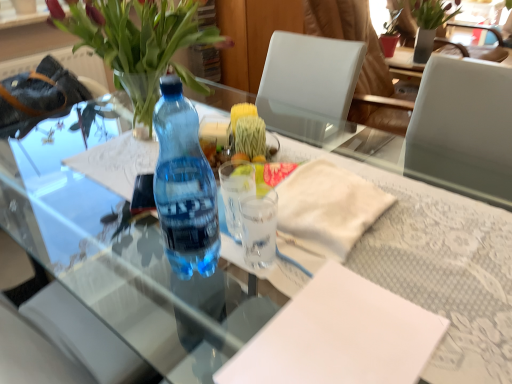
Describe the element at coordinates (139, 43) in the screenshot. The width and height of the screenshot is (512, 384). I see `translucent glass vase at upper left` at that location.

This screenshot has height=384, width=512. What are the coordinates of `transparent plastic bottle at center` in the screenshot? It's located at [x=184, y=186].

Find the location of a particular element. green matte vase at upper right is located at coordinates pyautogui.click(x=429, y=24).

Looking at this image, what is the approximate width of transparent glass cup at center, the 2th coffee cup positioned from the front?

The width of transparent glass cup at center, the 2th coffee cup positioned from the front, is 2.53 inches.

The width and height of the screenshot is (512, 384). Identify the location of translucent glass vase at upper left. (139, 43).

Is transparent glass cup at center, which is the second coffee cup from back to front, not close to transparent plastic bottle at center?

That's not correct — transparent glass cup at center, which is the second coffee cup from back to front, is a little close to transparent plastic bottle at center.

Between transparent glass cup at center, which is the second coffee cup from back to front, and transparent plastic bottle at center, which one has smaller size?

transparent glass cup at center, which is the second coffee cup from back to front, is smaller.

Does transparent glass cup at center, which is the second coffee cup from back to front, have a greater width compared to transparent plastic bottle at center?

In fact, transparent glass cup at center, which is the second coffee cup from back to front, might be narrower than transparent plastic bottle at center.

Which object is further away from the camera taking this photo, transparent glass cup at center, which is the second coffee cup from back to front, or transparent plastic bottle at center?

transparent glass cup at center, which is the second coffee cup from back to front, is more distant.

From their relative heights in the image, would you say white paper at center, the first notepad when ordered from top to bottom, is taller or shorter than transparent plastic bottle at center?

In the image, white paper at center, the first notepad when ordered from top to bottom, appears to be shorter than transparent plastic bottle at center.

Is white paper at center, the second notepad in the front-to-back sequence, oriented towards transparent plastic bottle at center?

No, white paper at center, the second notepad in the front-to-back sequence, is not oriented towards transparent plastic bottle at center.

Between white paper at center, marked as the 1th notepad in a back-to-front arrangement, and transparent plastic bottle at center, which one has smaller width?

transparent plastic bottle at center is thinner.

Is white paper at center, the first notepad when ordered from top to bottom, situated inside transparent plastic bottle at center or outside?

white paper at center, the first notepad when ordered from top to bottom, is not inside transparent plastic bottle at center, it's outside.

Consider the image. Is transparent glass cup at center, the 2th coffee cup positioned from the front, located outside transparent plastic bottle at center?

Yes.

From the picture: How distant is transparent glass cup at center, the 2th coffee cup positioned from the front, from transparent plastic bottle at center?

They are 5.25 inches apart.

Is point (230, 175) more distant than point (155, 130)?

That is False.

From a real-world perspective, between transparent glass cup at center, the 2th coffee cup positioned from the front, and transparent plastic bottle at center, who is vertically higher?

transparent plastic bottle at center is physically above.

From the picture: Between white paper at center, the first notepad when ordered from bottom to top, and transparent glass cup at center, acting as the 1th coffee cup starting from the front, which one has less height?

white paper at center, the first notepad when ordered from bottom to top.

Which of these two, white paper at center, the 2th notepad when ordered from top to bottom, or transparent glass cup at center, which is the second coffee cup from back to front, is thinner?

transparent glass cup at center, which is the second coffee cup from back to front, is thinner.

Is transparent glass cup at center, which is the second coffee cup from back to front, located within white paper at center, positioned as the second notepad in back-to-front order?

No, transparent glass cup at center, which is the second coffee cup from back to front, is not inside white paper at center, positioned as the second notepad in back-to-front order.

Can you confirm if transparent glass cup at center, arranged as the first coffee cup when viewed from the back, is positioned to the right of white paper at center, marked as the 1th notepad in a back-to-front arrangement?

No.

Is transparent glass cup at center, arranged as the first coffee cup when viewed from the back, positioned with its back to white paper at center, which is counted as the 2th notepad, starting from the bottom?

No, transparent glass cup at center, arranged as the first coffee cup when viewed from the back,'s orientation is not away from white paper at center, which is counted as the 2th notepad, starting from the bottom.

Between transparent glass cup at center, arranged as the first coffee cup when viewed from the back, and white paper at center, which is counted as the 2th notepad, starting from the bottom, which one has smaller width?

Thinner between the two is transparent glass cup at center, arranged as the first coffee cup when viewed from the back.

Consider the image. Does transparent plastic bottle at center have a lesser width compared to translucent glass vase at upper left?

Yes, transparent plastic bottle at center is thinner than translucent glass vase at upper left.

From the image's perspective, is transparent plastic bottle at center over translucent glass vase at upper left?

Actually, transparent plastic bottle at center appears below translucent glass vase at upper left in the image.

From a real-world perspective, between transparent plastic bottle at center and translucent glass vase at upper left, who is vertically higher?

In real-world perspective, translucent glass vase at upper left is above.

How far apart are transparent plastic bottle at center and translucent glass vase at upper left?

transparent plastic bottle at center is 10.35 inches away from translucent glass vase at upper left.

Does point (296, 347) appear closer or farther from the camera than point (433, 18)?

Clearly, point (296, 347) is closer to the camera than point (433, 18).

Which object is closer to the camera taking this photo, white paper at center, the first notepad when ordered from bottom to top, or green matte vase at upper right?

white paper at center, the first notepad when ordered from bottom to top, is in front.

Which of these two, white paper at center, which is the 1th notepad from front to back, or green matte vase at upper right, stands shorter?

white paper at center, which is the 1th notepad from front to back.

This screenshot has height=384, width=512. Find the location of `bottle on the left of transparent glass cup at center, acting as the 1th coffee cup starting from the front`. bottle on the left of transparent glass cup at center, acting as the 1th coffee cup starting from the front is located at coordinates (184, 186).

Identify the location of bottle that appears above the white paper at center, the first notepad when ordered from top to bottom (from the image's perspective). (184, 186).

Considering their positions, is transparent glass cup at center, which is the second coffee cup from back to front, positioned closer to green matte vase at upper right than white paper at center, marked as the 1th notepad in a back-to-front arrangement?

white paper at center, marked as the 1th notepad in a back-to-front arrangement, is closer to green matte vase at upper right.

Estimate the real-world distances between objects in this image. Which object is further from white paper at center, the second notepad in the front-to-back sequence, white paper at center, the 2th notepad when ordered from top to bottom, or green matte vase at upper right?

Among the two, green matte vase at upper right is located further to white paper at center, the second notepad in the front-to-back sequence.

Based on the photo, considering their positions, is translucent glass vase at upper left positioned closer to white paper at center, which is counted as the 2th notepad, starting from the bottom, than transparent glass cup at center, the 2th coffee cup positioned from the front?

Based on the image, transparent glass cup at center, the 2th coffee cup positioned from the front, appears to be nearer to white paper at center, which is counted as the 2th notepad, starting from the bottom.

Estimate the real-world distances between objects in this image. Which object is closer to transparent plastic bottle at center, translucent glass vase at upper left or green matte vase at upper right?

translucent glass vase at upper left is positioned closer to the anchor transparent plastic bottle at center.

Estimate the real-world distances between objects in this image. Which object is closer to translucent glass vase at upper left, green matte vase at upper right or transparent glass cup at center, arranged as the first coffee cup when viewed from the back?

transparent glass cup at center, arranged as the first coffee cup when viewed from the back, is closer to translucent glass vase at upper left.

Looking at this image, from the image, which object appears to be farther from green matte vase at upper right, white paper at center, which is the 1th notepad from front to back, or white paper at center, which is counted as the 2th notepad, starting from the bottom?

white paper at center, which is the 1th notepad from front to back, lies further to green matte vase at upper right than the other object.

Estimate the real-world distances between objects in this image. Which object is further from translucent glass vase at upper left, white paper at center, the first notepad when ordered from top to bottom, or white paper at center, which is the 1th notepad from front to back?

white paper at center, which is the 1th notepad from front to back.

Which object lies nearer to the anchor point white paper at center, which is counted as the 2th notepad, starting from the bottom, transparent glass cup at center, acting as the 1th coffee cup starting from the front, or white paper at center, which is the 1th notepad from front to back?

transparent glass cup at center, acting as the 1th coffee cup starting from the front, lies closer to white paper at center, which is counted as the 2th notepad, starting from the bottom, than the other object.

The width and height of the screenshot is (512, 384). Find the location of `notepad located between white paper at center, which is the 1th notepad from front to back, and transparent glass cup at center, arranged as the first coffee cup when viewed from the back, in the depth direction`. notepad located between white paper at center, which is the 1th notepad from front to back, and transparent glass cup at center, arranged as the first coffee cup when viewed from the back, in the depth direction is located at coordinates (328, 207).

Image resolution: width=512 pixels, height=384 pixels. Find the location of `bottle between translucent glass vase at upper left and white paper at center, marked as the 1th notepad in a back-to-front arrangement, from left to right`. bottle between translucent glass vase at upper left and white paper at center, marked as the 1th notepad in a back-to-front arrangement, from left to right is located at coordinates (184, 186).

Find the location of a particular element. The width and height of the screenshot is (512, 384). coffee cup between transparent plastic bottle at center and transparent glass cup at center, the 2th coffee cup positioned from the front, from front to back is located at coordinates (259, 229).

In order to click on bottle between white paper at center, the first notepad when ordered from bottom to top, and green matte vase at upper right in the front-back direction in this screenshot , I will do `click(184, 186)`.